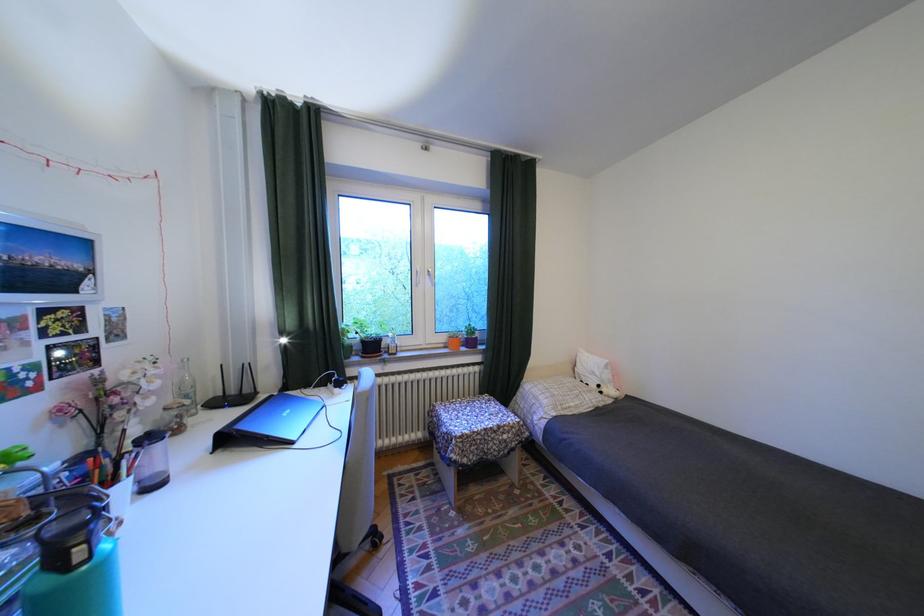
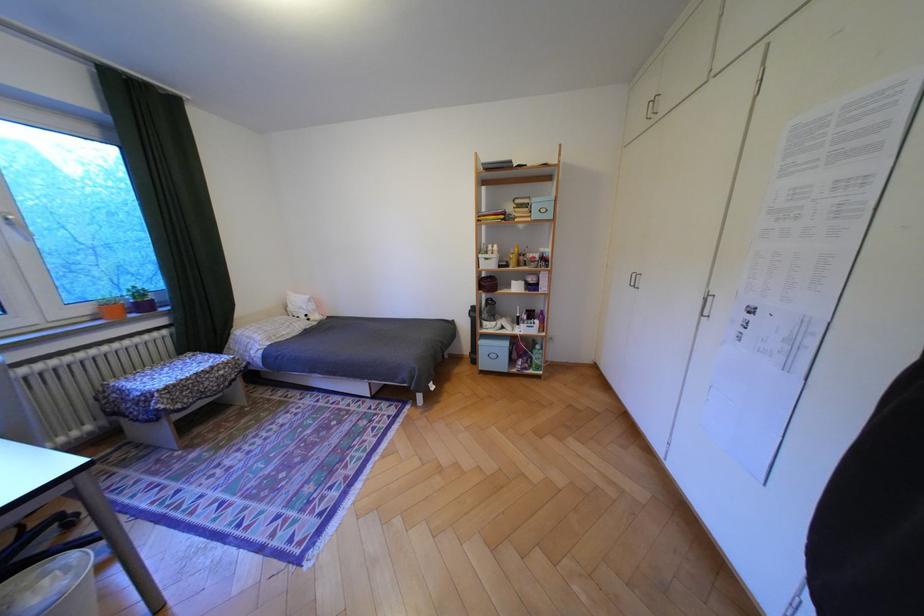
In the second image, find the point that corresponds to (439,277) in the first image.

(18, 227)